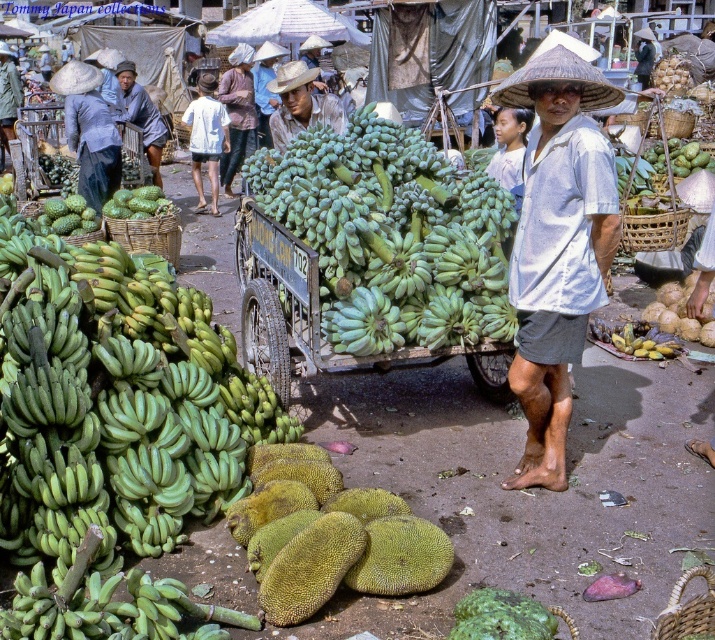
Question: Which point is farther from the camera taking this photo?

Choices:
 (A) (197, 180)
 (B) (107, 208)
 (C) (127, 80)
 (D) (661, 352)

Answer: (A)

Question: Among these objects, which one is nearest to the camera?

Choices:
 (A) white cotton shirt at center
 (B) light blue fabric at center
 (C) matte gray shirt at center

Answer: (C)

Question: Is light brown straw hat at center smaller than green matte bananas at center?

Choices:
 (A) yes
 (B) no

Answer: (B)

Question: Is green rubber cart at center to the left of matte gray shirt at center from the viewer's perspective?

Choices:
 (A) yes
 (B) no

Answer: (B)

Question: Among these points, which one is nearest to the camera?

Choices:
 (A) (246, 92)
 (B) (217, 154)
 (C) (149, 211)
 (D) (143, 108)

Answer: (C)

Question: Is light blue fabric at center positioned at the back of green matte bananas at center?

Choices:
 (A) no
 (B) yes

Answer: (B)